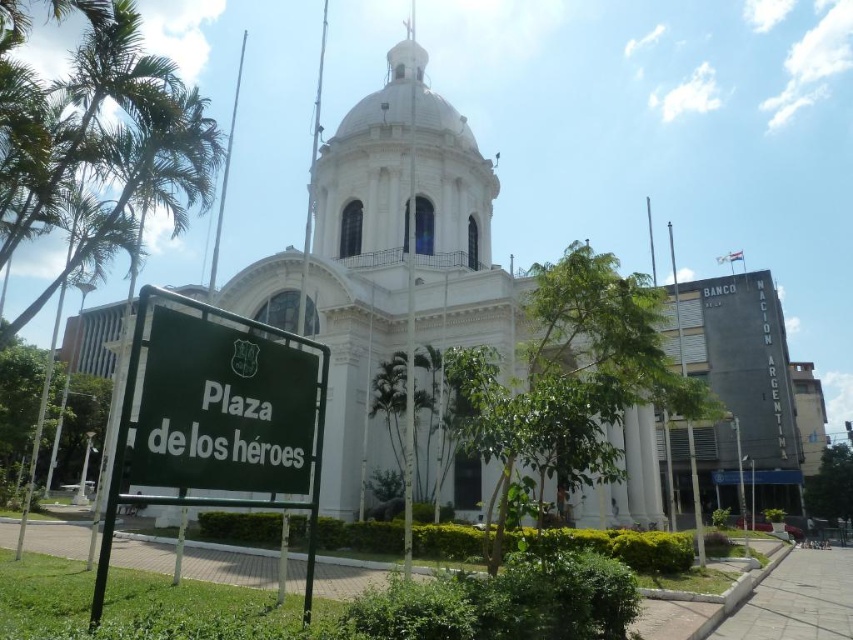
You are standing at the Heroes Square and want to locate the white marble church at center and the green matte sign at lower left. Based on their positions, which object is closer to your right side?

The green matte sign at lower left is closer to your right side because the white marble church at center is positioned to the left of it.

You are standing at the Heroes Square and want to take a photo of the grand white building with the dome. There are two points marked on the ground where you can stand. The first point is at coordinate point[645,497] and the second is at point[265,465]. Which point should you choose to ensure the building is fully visible without any obstruction from the flagpoles?

You should choose point[265,465] because point[645,497] is behind point[265,465], meaning standing at the latter position would provide a clearer view of the building without obstruction from the flagpoles in front.